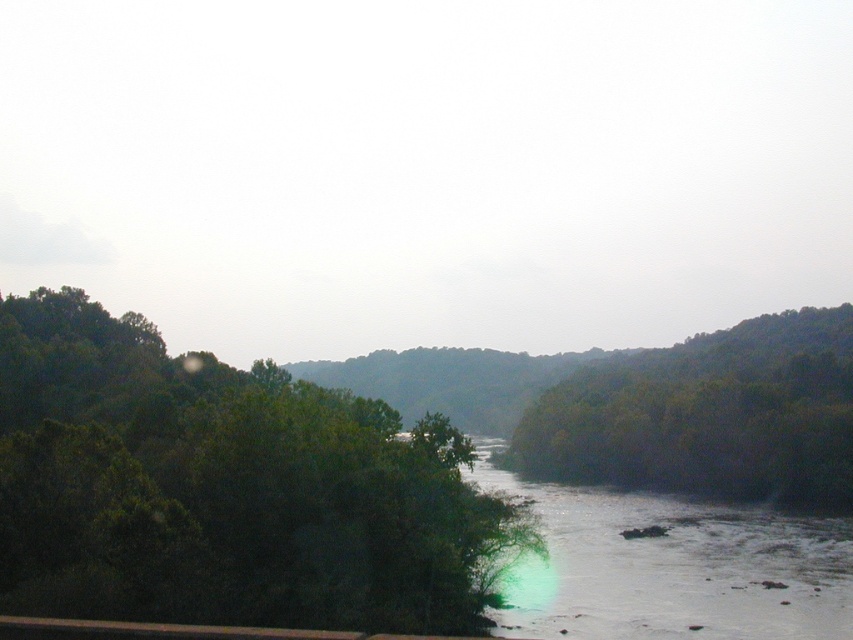
Does green leafy tree at left have a lesser width compared to clear water at center?

Incorrect, green leafy tree at left's width is not less than clear water at center's.

Does green leafy tree at left appear under clear water at center?

No, green leafy tree at left is not below clear water at center.

Is point (341, 481) positioned in front of point (669, 540)?

Yes.

Locate an element on the screen. green leafy tree at left is located at coordinates (225, 490).

Which is below, green leafy tree at left or green leafy trees at right?

green leafy trees at right is below.

Does green leafy tree at left have a greater width compared to green leafy trees at right?

No.

The height and width of the screenshot is (640, 853). Describe the element at coordinates (225, 490) in the screenshot. I see `green leafy tree at left` at that location.

You are a GUI agent. You are given a task and a screenshot of the screen. Output one action in this format:
    pyautogui.click(x=<x>, y=<y>)
    Task: Click on the green leafy tree at left
    Image resolution: width=853 pixels, height=640 pixels.
    Given the screenshot: What is the action you would take?
    pyautogui.click(x=225, y=490)

Who is taller, green leafy trees at right or clear water at center?

With more height is green leafy trees at right.

Between green leafy trees at right and clear water at center, which one has less height?

With less height is clear water at center.

Does point (815, 356) come closer to viewer compared to point (712, 547)?

That is False.

The image size is (853, 640). In order to click on green leafy trees at right in this screenshot , I will do `click(708, 416)`.